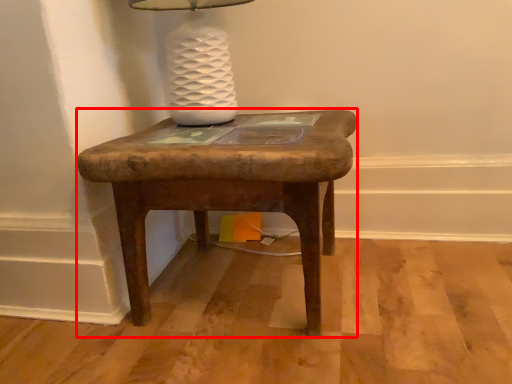
Question: From the image's perspective, what is the correct spatial relationship of stool (annotated by the red box) in relation to table lamp?

Choices:
 (A) above
 (B) below

Answer: (B)